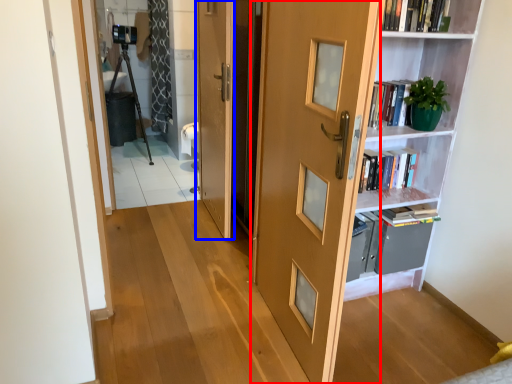
Question: Which point is further to the camera, door (highlighted by a red box) or door (highlighted by a blue box)?

Choices:
 (A) door
 (B) door

Answer: (B)